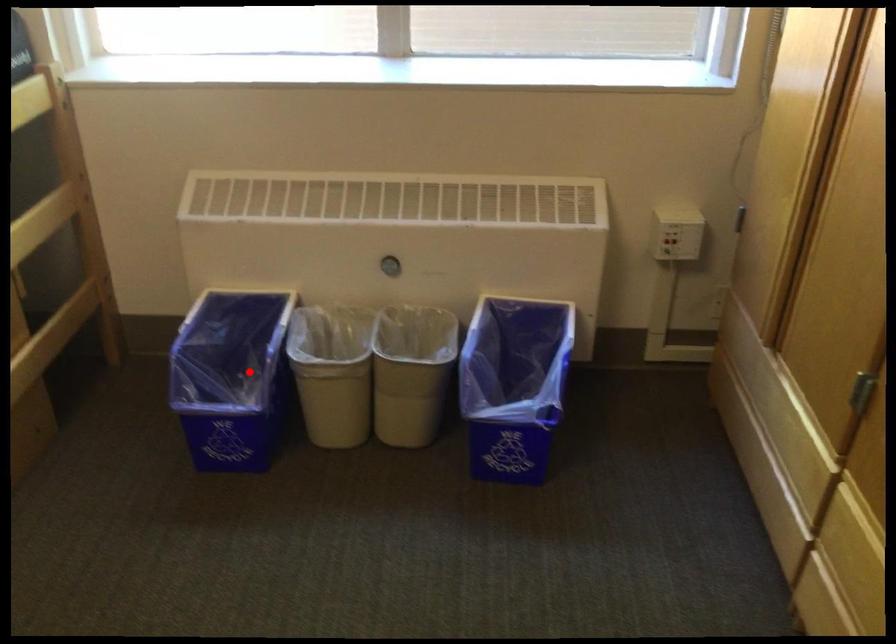
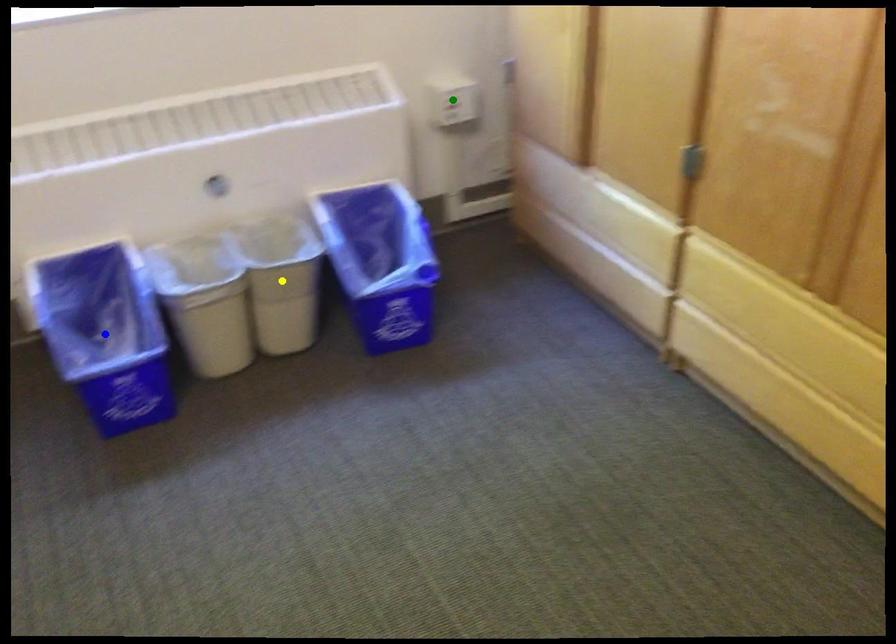
Question: I am providing you with two images of the same scene from different viewpoints. A red point is marked on the first image. You are given multiple points on the second image. In image 2, which mark is for the same physical point as the one in image 1?

Choices:
 (A) green point
 (B) yellow point
 (C) blue point

Answer: (C)